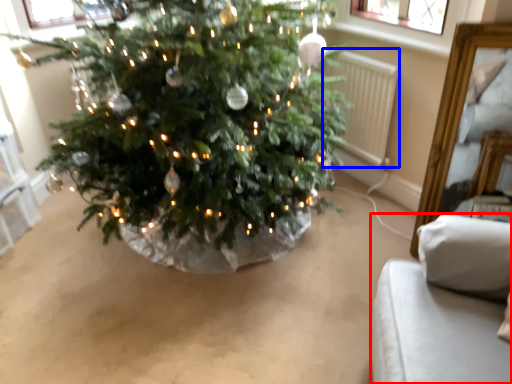
Question: Which of the following is the closest to the observer, furniture (highlighted by a red box) or radiator (highlighted by a blue box)?

Choices:
 (A) furniture
 (B) radiator

Answer: (A)